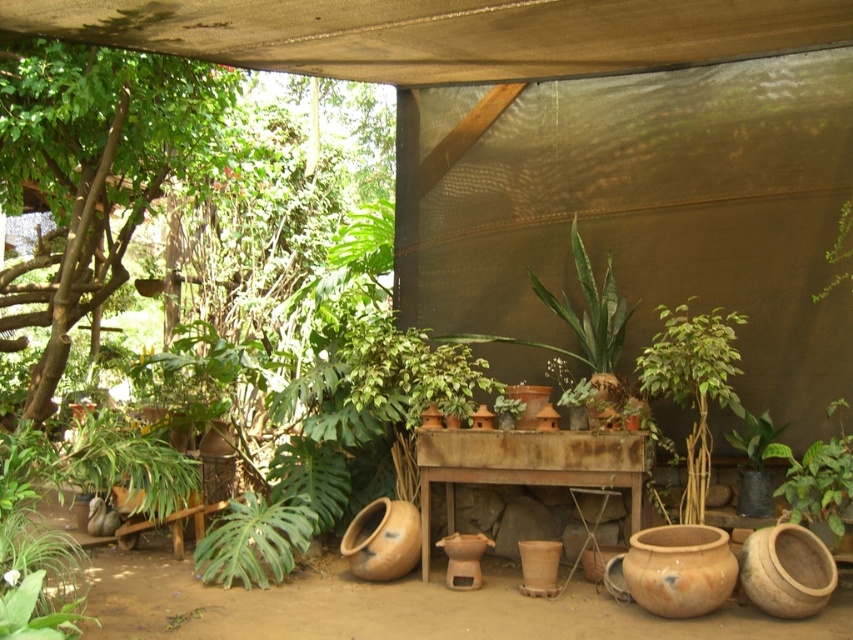
Question: Can you confirm if green leafy tree at left is smaller than rusty metal table at center?

Choices:
 (A) no
 (B) yes

Answer: (A)

Question: Which point appears closest to the camera in this image?

Choices:
 (A) (637, 481)
 (B) (64, 348)

Answer: (B)

Question: Can you confirm if green leafy tree at left is thinner than rusty metal table at center?

Choices:
 (A) no
 (B) yes

Answer: (A)

Question: Which object is closer to the camera taking this photo?

Choices:
 (A) green leafy tree at left
 (B) rusty metal table at center

Answer: (A)

Question: In this image, where is green leafy tree at left located relative to rusty metal table at center?

Choices:
 (A) left
 (B) right

Answer: (A)

Question: Which point is closer to the camera?

Choices:
 (A) rusty metal table at center
 (B) green leafy tree at left

Answer: (B)